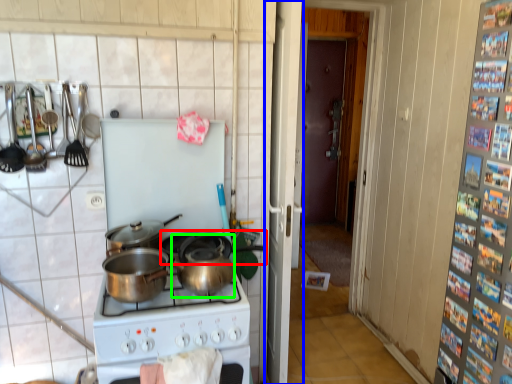
Question: Based on their relative distances, which object is nearer to wok (highlighted by a red box)? Choose from screen door (highlighted by a blue box) and crock pot (highlighted by a green box).

Choices:
 (A) screen door
 (B) crock pot

Answer: (B)